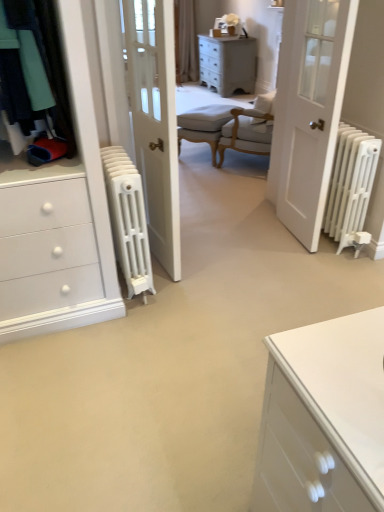
Where is `free point to the left of white matte radiator at right, the 1th radiator viewed from the right`? Image resolution: width=384 pixels, height=512 pixels. free point to the left of white matte radiator at right, the 1th radiator viewed from the right is located at coordinates (274, 247).